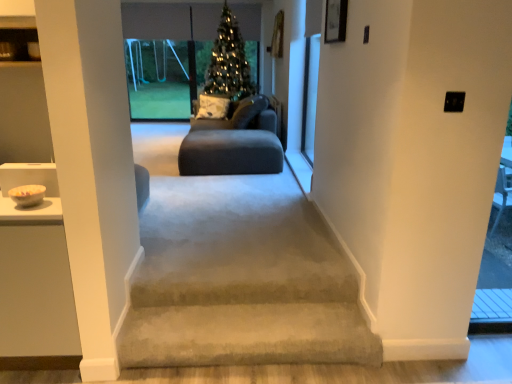
Question: Does point (199, 114) appear closer or farther from the camera than point (216, 46)?

Choices:
 (A) closer
 (B) farther

Answer: (B)

Question: From the image's perspective, is white textured pillow at center positioned above or below green matte christmas tree at center?

Choices:
 (A) below
 (B) above

Answer: (A)

Question: Estimate the real-world distances between objects in this image. Which object is farther from the white textured pillow at center?

Choices:
 (A) transparent glass screen door at upper right
 (B) transparent glass swing set at upper center
 (C) green matte christmas tree at center
 (D) suede-like dark gray sofa at center

Answer: (A)

Question: Which of these objects is positioned closest to the transparent glass swing set at upper center?

Choices:
 (A) white textured pillow at center
 (B) green matte christmas tree at center
 (C) transparent glass screen door at upper right
 (D) suede-like dark gray sofa at center

Answer: (B)